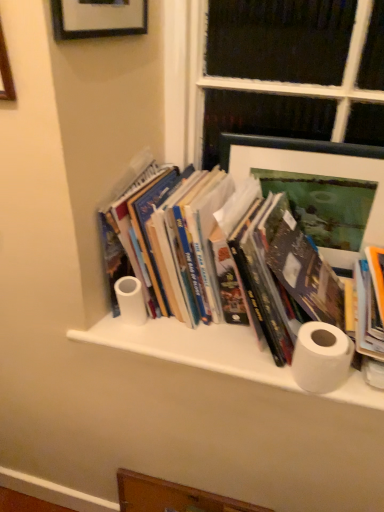
Where is `vacant position to the left of white matte toilet paper at center, the 2th toilet paper viewed from the front`? vacant position to the left of white matte toilet paper at center, the 2th toilet paper viewed from the front is located at coordinates (102, 324).